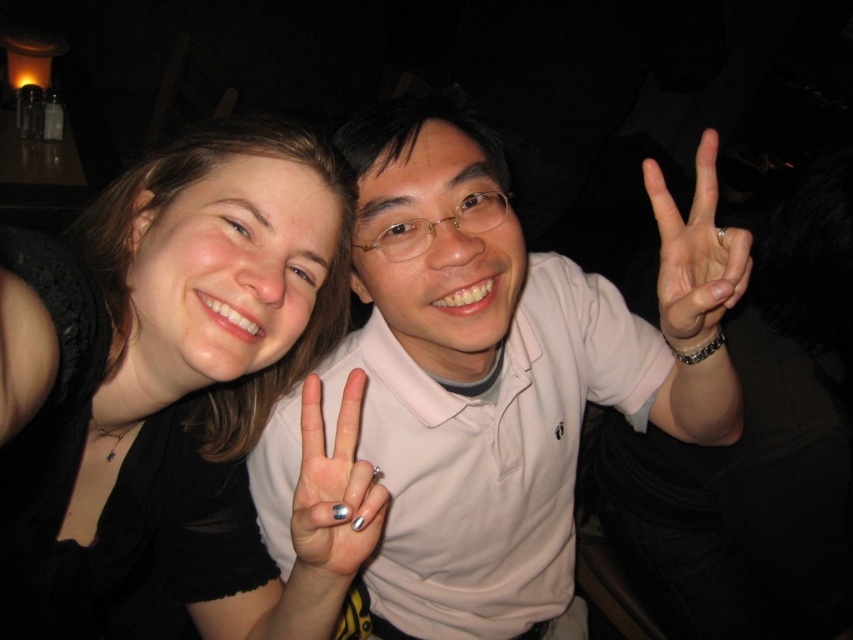
Question: Does white matte shirt at center come in front of silver metallic nails at center?

Choices:
 (A) yes
 (B) no

Answer: (B)

Question: Which of the following is the farthest from the observer?

Choices:
 (A) white matte hand at center
 (B) white matte shirt at center

Answer: (B)

Question: Is black matte shirt at center below white matte shirt at center?

Choices:
 (A) yes
 (B) no

Answer: (A)

Question: Which point is farther to the camera?

Choices:
 (A) silver metallic nails at center
 (B) white matte shirt at center
 (C) white matte hand at center
 (D) black matte shirt at center

Answer: (B)

Question: Does black matte shirt at center come in front of silver metallic nails at center?

Choices:
 (A) yes
 (B) no

Answer: (A)

Question: Among these objects, which one is nearest to the camera?

Choices:
 (A) silver metallic nails at center
 (B) white matte hand at center
 (C) black matte shirt at center
 (D) white matte shirt at center

Answer: (C)